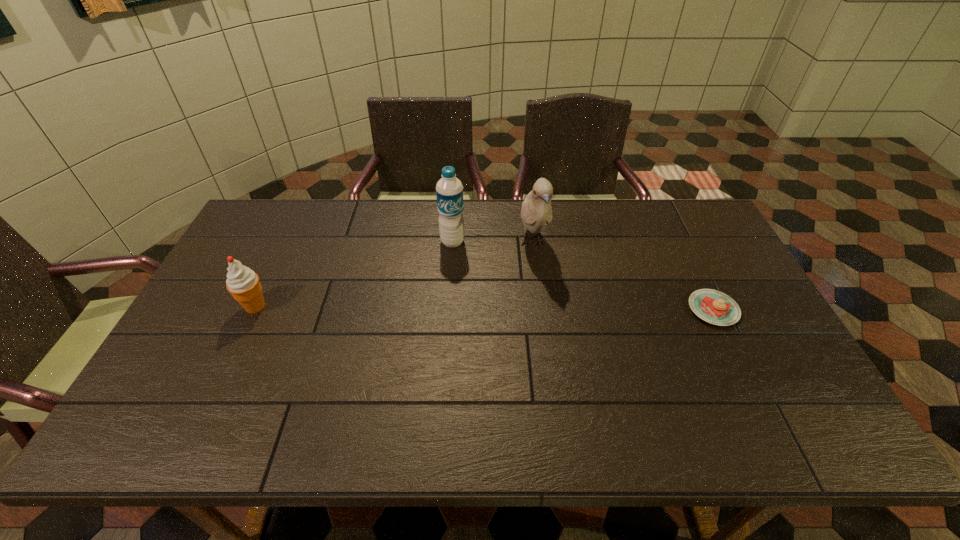
Where is `the leftmost object`? This screenshot has height=540, width=960. the leftmost object is located at coordinates (243, 283).

At what (x,y) coordinates should I click in order to perform the action: click on the third tallest object. Please return your answer as a coordinate pair (x, y). Looking at the image, I should click on (243, 283).

I want to click on pastry, so click(712, 306).

Locate an element on the screen. The width and height of the screenshot is (960, 540). the rightmost object is located at coordinates (712, 306).

I want to click on the second object from right to left, so click(x=536, y=211).

What are the coordinates of `water bottle` in the screenshot? It's located at (449, 190).

Find the location of a particular element. vacant area located 0.150m on the back of the icecream is located at coordinates click(x=277, y=261).

Identify the location of vacant space located 0.280m on the left of the pastry. This screenshot has width=960, height=540. (589, 309).

This screenshot has width=960, height=540. I want to click on blank area located 0.210m at the beak of the bird, so click(x=551, y=322).

At what (x,y) coordinates should I click in order to perform the action: click on free point located 0.340m at the beak of the bird. Please return your answer as a coordinate pair (x, y). The width and height of the screenshot is (960, 540). Looking at the image, I should click on (561, 361).